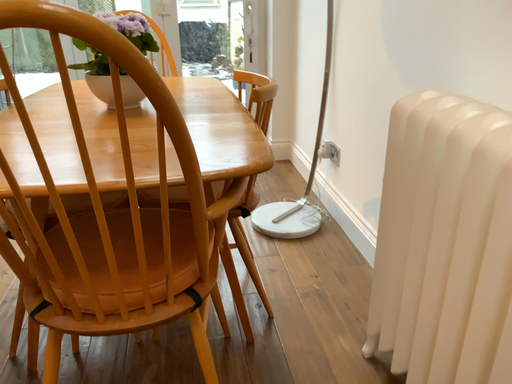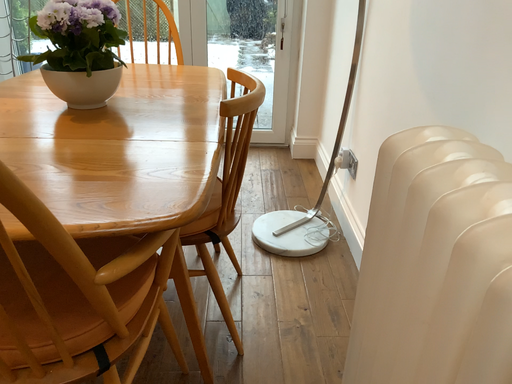
Question: Which way did the camera rotate in the video?

Choices:
 (A) rotated left
 (B) rotated right

Answer: (A)